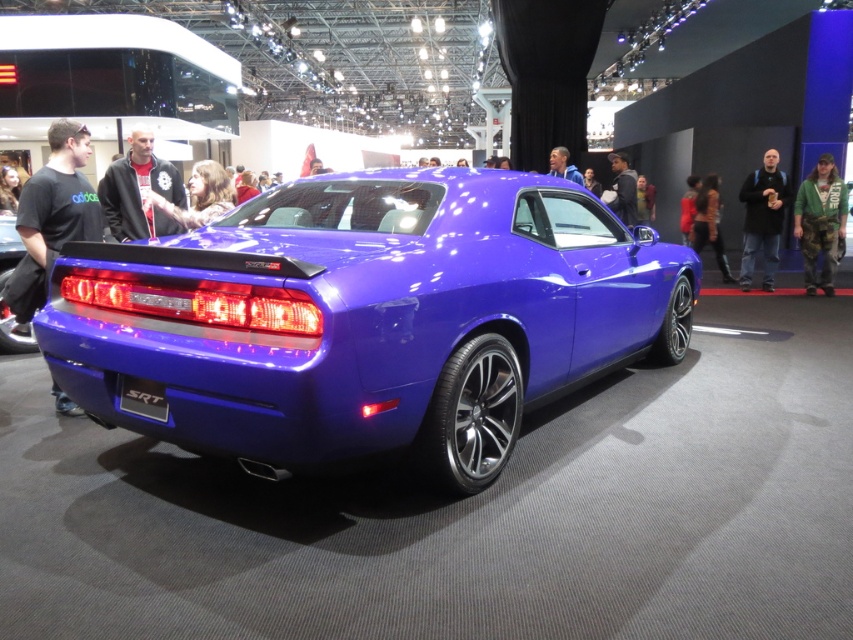
Question: Estimate the real-world distances between objects in this image. Which object is closer to the green camouflage pants at right?

Choices:
 (A) yellow-green shirt at center
 (B) fluffy brown hair at center
 (C) glossy blue car at center

Answer: (A)

Question: Is glossy blue car at center closer to camera compared to yellow-green shirt at center?

Choices:
 (A) yes
 (B) no

Answer: (A)

Question: Is fluffy brown hair at center smaller than blue metallic car at center?

Choices:
 (A) no
 (B) yes

Answer: (B)

Question: Among these points, which one is nearest to the camera?

Choices:
 (A) (209, 220)
 (B) (51, 296)

Answer: (B)

Question: Which of the following is the closest to the observer?

Choices:
 (A) black matte srt at rear
 (B) glossy blue car at center
 (C) black fleece jacket at center
 (D) glossy metallic car at center

Answer: (D)

Question: From the image, what is the correct spatial relationship of fluffy brown hair at center in relation to blue metallic car at center?

Choices:
 (A) above
 (B) below

Answer: (B)